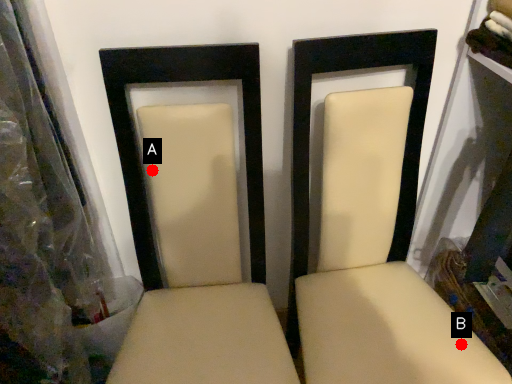
Question: Two points are circled on the image, labeled by A and B beside each circle. Which point is closer to the camera?

Choices:
 (A) A is closer
 (B) B is closer

Answer: (A)